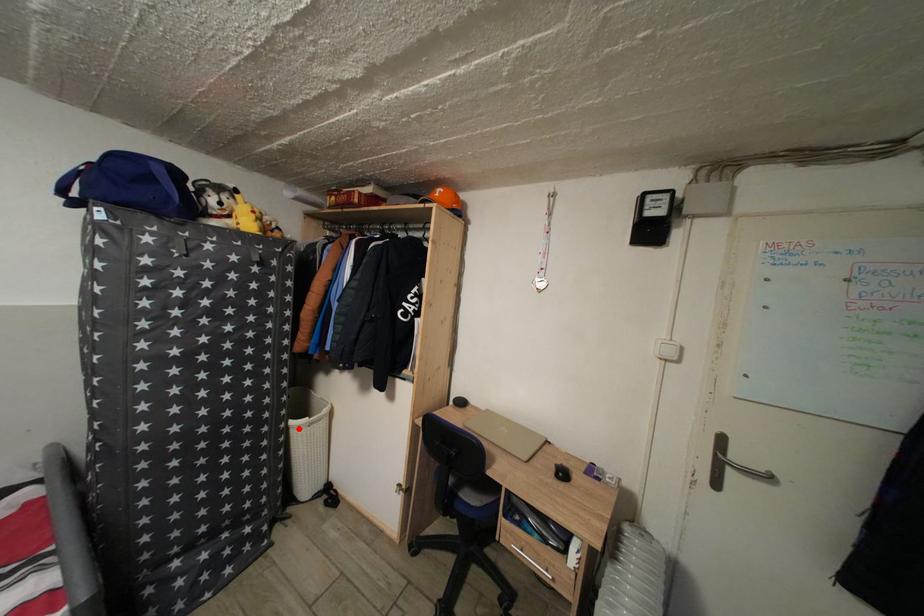
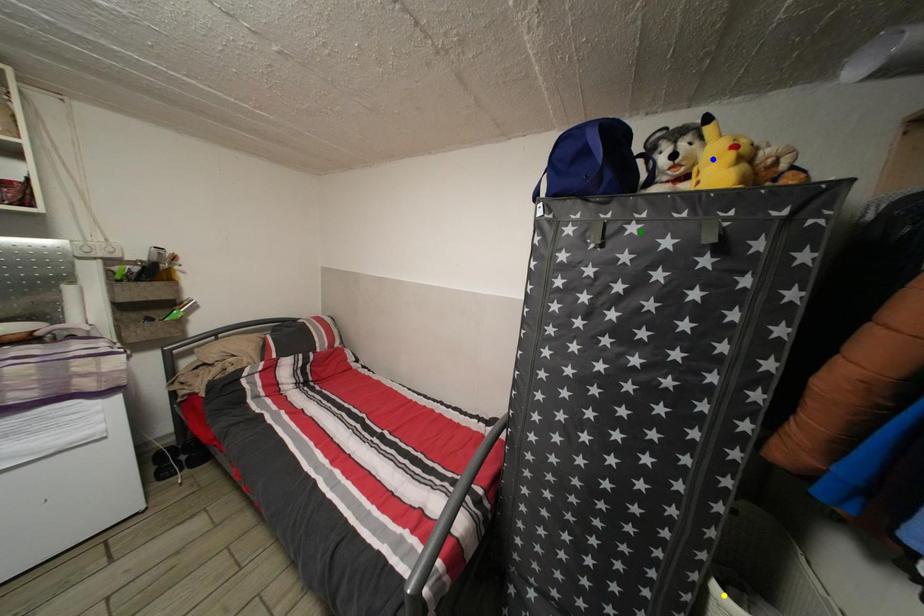
Question: I am providing you with two images of the same scene from different viewpoints. A red point is marked on the first image. You are given multiple points on the second image. Which point in image 2 represents the same 3d spot as the red point in image 1?

Choices:
 (A) yellow point
 (B) green point
 (C) blue point

Answer: (A)